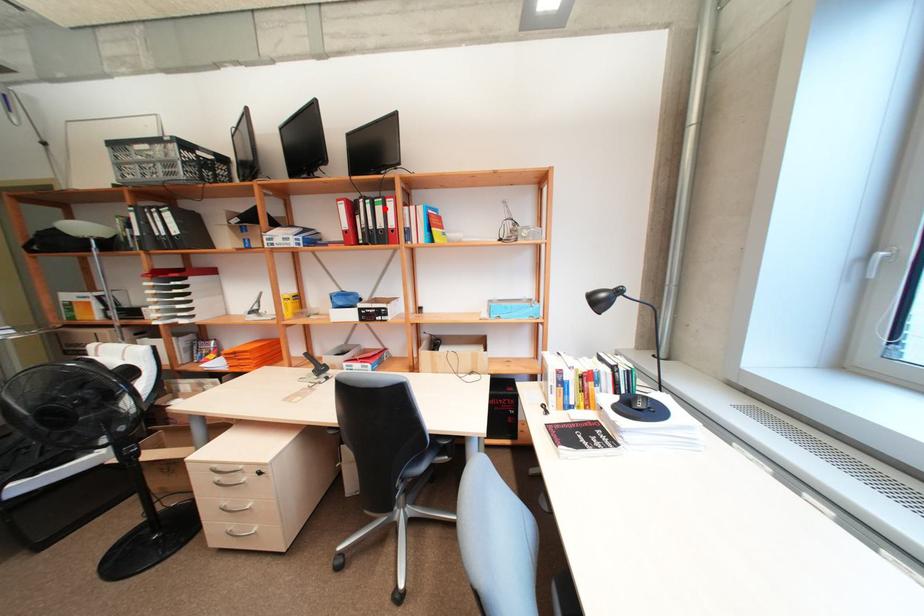
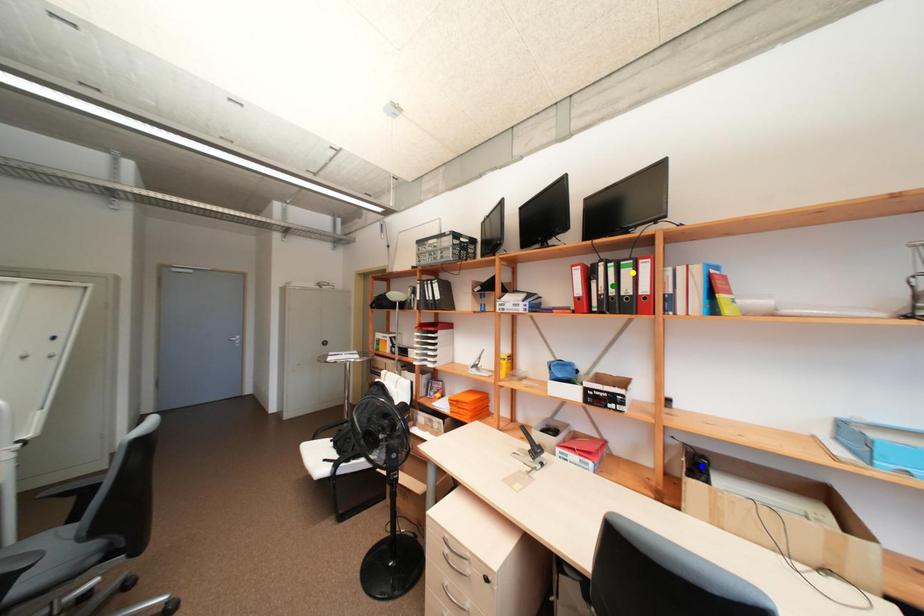
Question: I am providing you with two images of the same scene from different viewpoints. A red point is marked on the first image. You are given multiple points on the second image. Which spot in image 2 lines up with the point in image 1?

Choices:
 (A) green point
 (B) yellow point
 (C) blue point

Answer: (B)